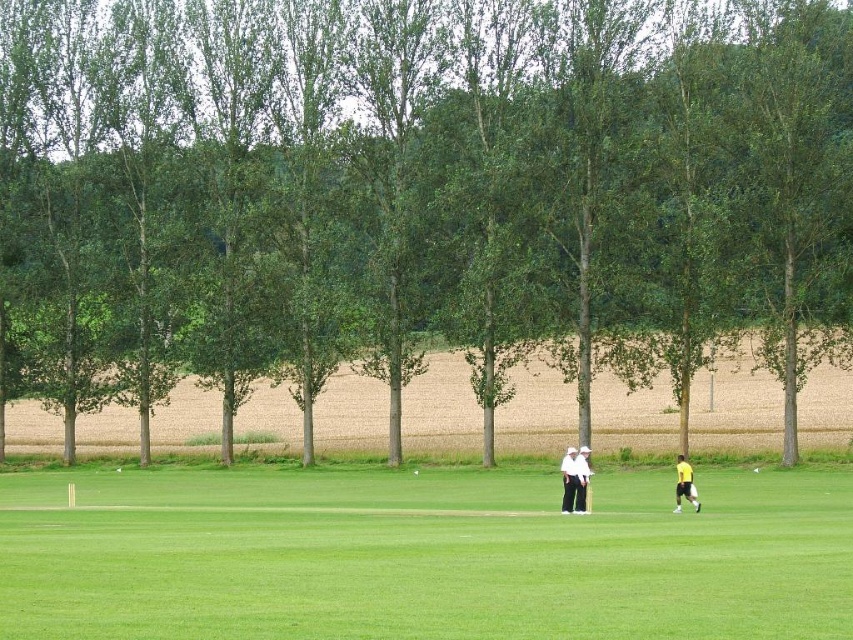
Does point (577, 477) come farther from viewer compared to point (685, 490)?

No.

Between point (577, 461) and point (676, 506), which one is positioned in front?

Positioned in front is point (577, 461).

Image resolution: width=853 pixels, height=640 pixels. What do you see at coordinates (575, 480) in the screenshot? I see `white cotton shirt and trousers at center` at bounding box center [575, 480].

I want to click on white cotton shirt and trousers at center, so click(x=575, y=480).

Who is more distant from viewer, (318, 33) or (680, 456)?

The point (318, 33) is more distant.

Is green leafy tree at center below yellow fabric person at lower right?

Incorrect, green leafy tree at center is not positioned below yellow fabric person at lower right.

Describe the element at coordinates (476, 209) in the screenshot. The width and height of the screenshot is (853, 640). I see `green leafy tree at center` at that location.

Identify the location of green leafy tree at center. This screenshot has height=640, width=853. (476, 209).

Can you confirm if green grass at center is smaller than white cotton shirt and trousers at center?

Actually, green grass at center might be larger than white cotton shirt and trousers at center.

Looking at this image, can you confirm if green grass at center is positioned to the left of white cotton shirt and trousers at center?

Correct, you'll find green grass at center to the left of white cotton shirt and trousers at center.

At what (x,y) coordinates should I click in order to perform the action: click on green grass at center. Please return your answer as a coordinate pair (x, y). The height and width of the screenshot is (640, 853). Looking at the image, I should click on (422, 556).

You are a GUI agent. You are given a task and a screenshot of the screen. Output one action in this format:
    pyautogui.click(x=<x>, y=<y>)
    Task: Click on the green grass at center
    This screenshot has width=853, height=640.
    Given the screenshot: What is the action you would take?
    pyautogui.click(x=422, y=556)